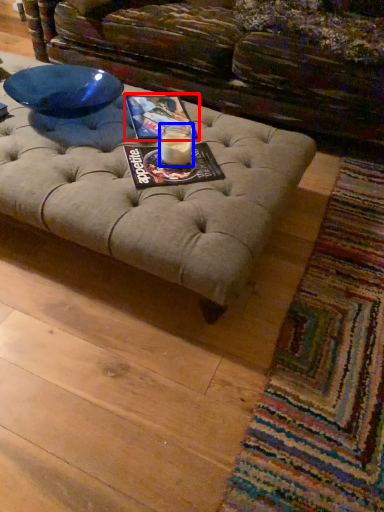
Question: Which object is further to the camera taking this photo, magazine (highlighted by a red box) or candle holder (highlighted by a blue box)?

Choices:
 (A) magazine
 (B) candle holder

Answer: (A)